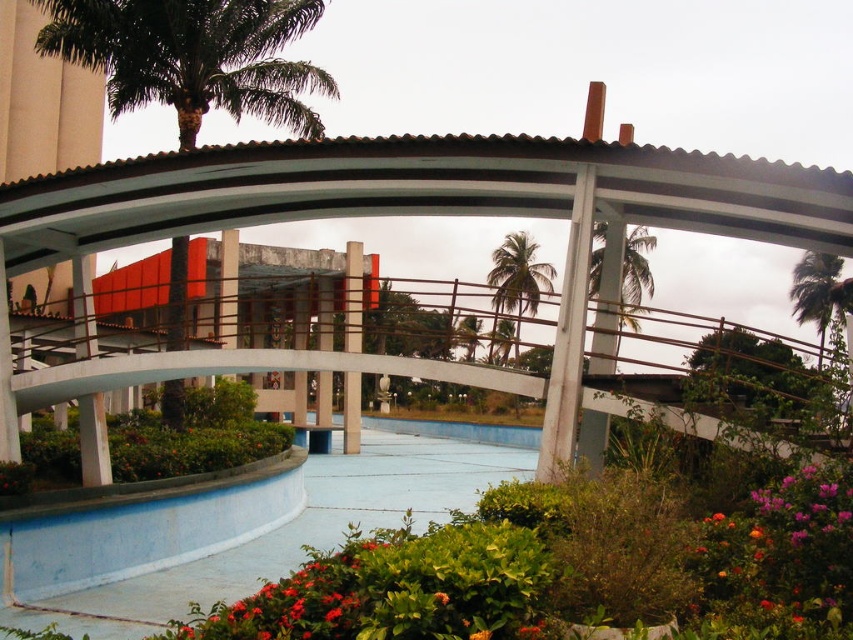
Question: Which object is the closest to the vivid red petals at lower center?

Choices:
 (A) green leafy palm tree at upper left
 (B) green leafy palm tree at upper right

Answer: (A)

Question: Where is green leafy palm tree at center located in relation to green leafy palm tree at upper center in the image?

Choices:
 (A) left
 (B) right

Answer: (B)

Question: Which object is the closest to the green leafy palm tree at center?

Choices:
 (A) vivid red petals at lower center
 (B) green leafy palm tree at upper center

Answer: (B)

Question: Does vivid red petals at lower center appear under green leafy palm tree at center?

Choices:
 (A) no
 (B) yes

Answer: (B)

Question: Can you confirm if green leafy palm tree at upper center is positioned below green leafy palm tree at upper right?

Choices:
 (A) no
 (B) yes

Answer: (A)

Question: Among these objects, which one is farthest from the camera?

Choices:
 (A) green leafy palm tree at center
 (B) green leafy palm tree at upper center
 (C) vivid red petals at lower center

Answer: (B)